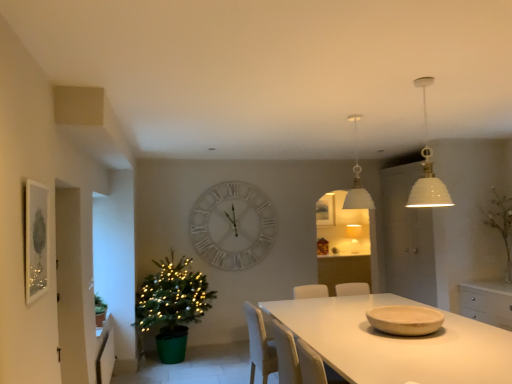
Where is `vacant space underneath white ceramic lampshade at upper right, which is the first lamp from front to back (from a real-world perspective)`? This screenshot has height=384, width=512. vacant space underneath white ceramic lampshade at upper right, which is the first lamp from front to back (from a real-world perspective) is located at coordinates (435, 345).